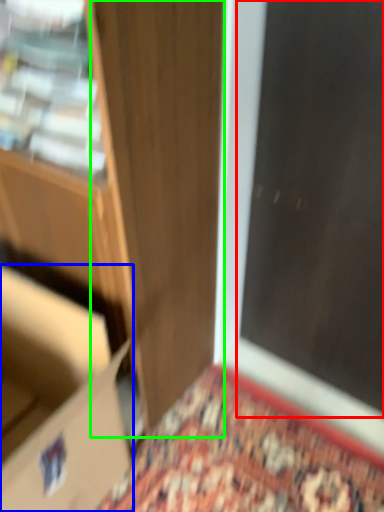
Question: Which is nearer to the screen door (highlighted by a red box)? cardboard box (highlighted by a blue box) or door (highlighted by a green box).

Choices:
 (A) cardboard box
 (B) door

Answer: (B)